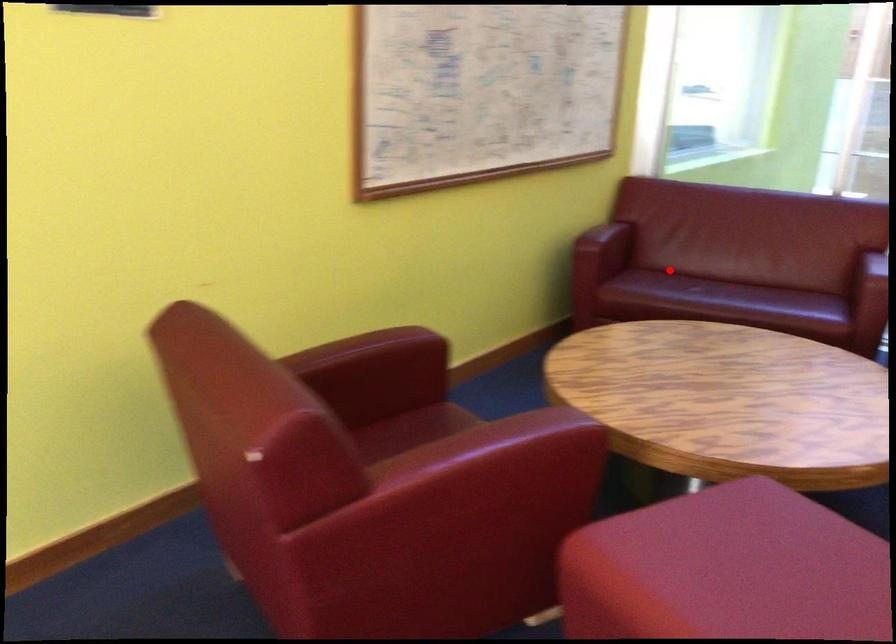
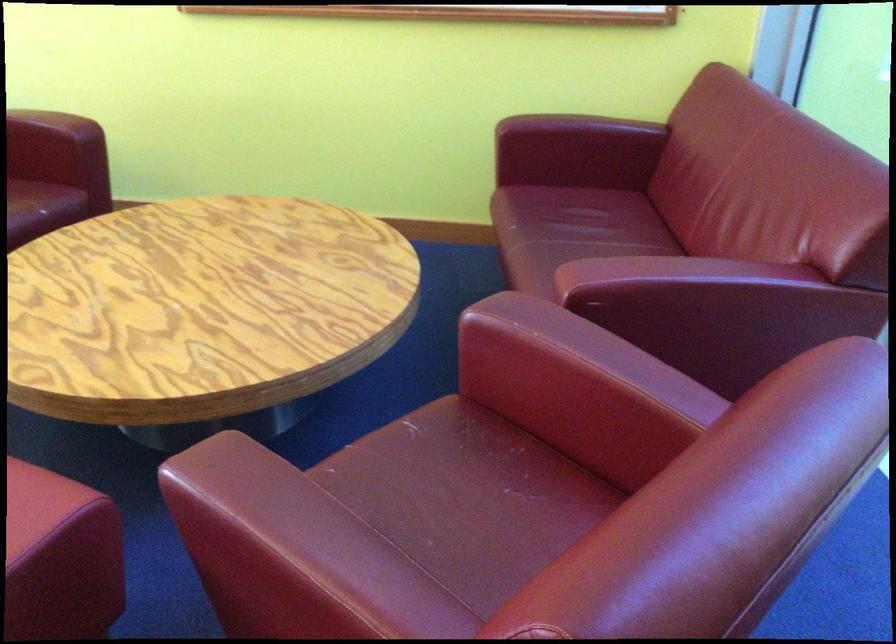
Where in the second image is the point corresponding to the highlighted location from the first image?

(592, 210)